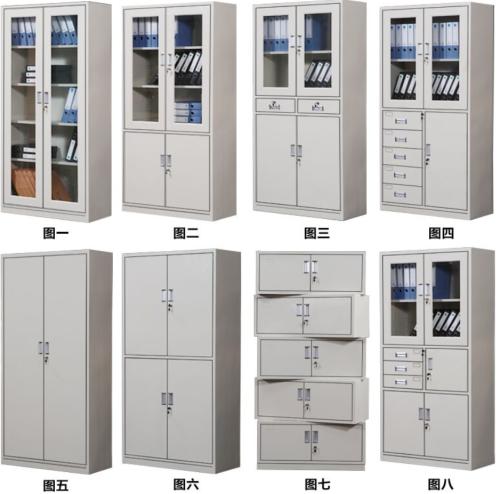
The width and height of the screenshot is (500, 494). What are the coordinates of `the smaller glass door white cabinet to right of center` in the screenshot? It's located at (310, 77).